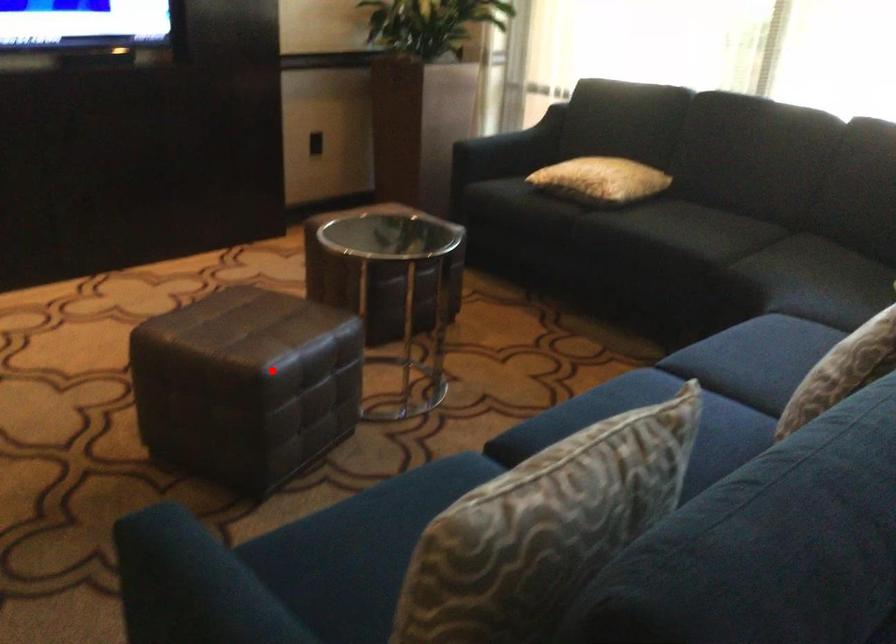
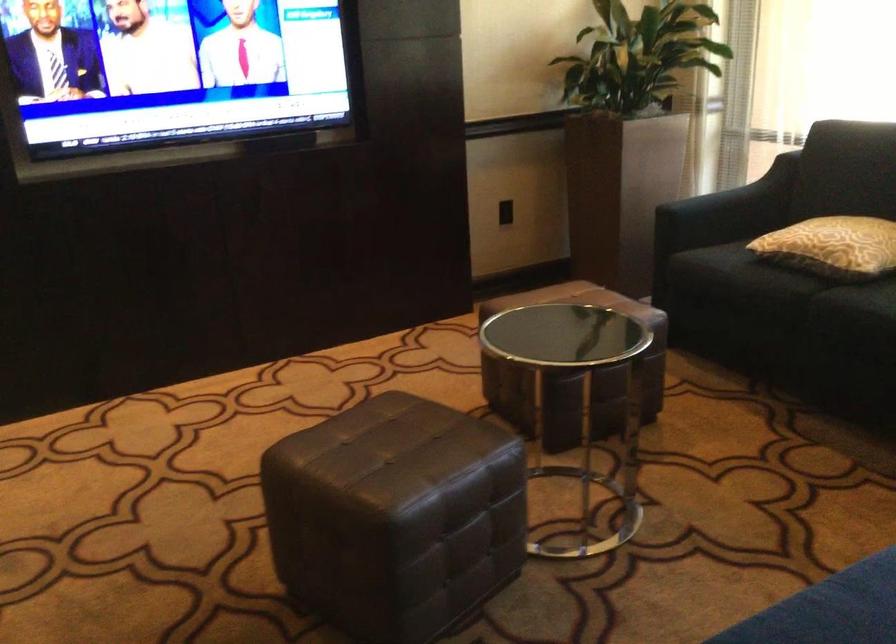
The point at the highlighted location is marked in the first image. Where is the corresponding point in the second image?

(394, 516)